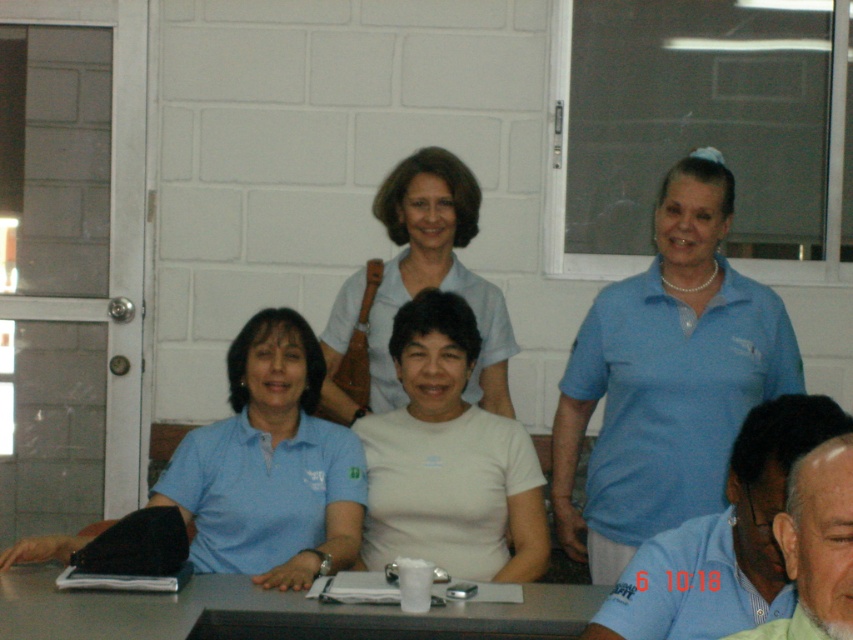
Question: Which object is farther from the camera taking this photo?

Choices:
 (A) metallic gray table at center
 (B) blue shirt at center

Answer: (A)

Question: Does metallic gray table at center appear on the right side of green shirt at lower right?

Choices:
 (A) yes
 (B) no

Answer: (B)

Question: Among these objects, which one is farthest from the camera?

Choices:
 (A) matte blue polo shirt at upper right
 (B) green shirt at lower right
 (C) matte blue polo shirt at lower left

Answer: (A)

Question: Does matte blue polo shirt at upper right have a larger size compared to metallic gray table at center?

Choices:
 (A) no
 (B) yes

Answer: (B)

Question: Is matte blue polo shirt at upper right to the left of blue shirt at center from the viewer's perspective?

Choices:
 (A) yes
 (B) no

Answer: (B)

Question: Which point is farther to the camera?

Choices:
 (A) (457, 616)
 (B) (851, 611)
 (C) (587, 525)

Answer: (C)